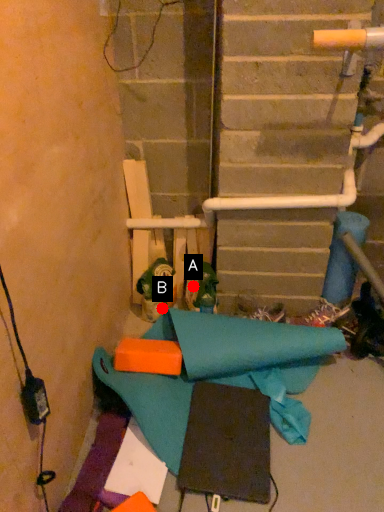
Question: Two points are circled on the image, labeled by A and B beside each circle. Which point appears closest to the camera in this image?

Choices:
 (A) A is closer
 (B) B is closer

Answer: (A)